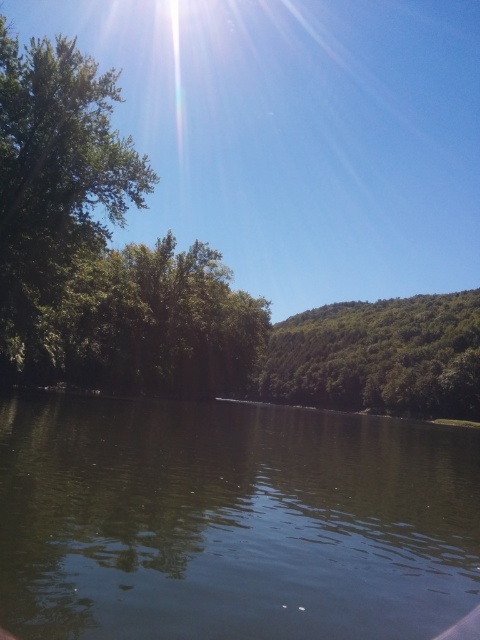
Does green reflective water at center appear on the left side of green leafy tree at left?

No, green reflective water at center is not to the left of green leafy tree at left.

In the scene shown: Who is taller, green reflective water at center or green leafy tree at left?

With more height is green leafy tree at left.

Measure the distance between point (302, 600) and camera.

A: 7.39 meters

Where is `green reflective water at center`? The image size is (480, 640). green reflective water at center is located at coordinates (231, 522).

Can you confirm if green reflective water at center is thinner than green leafy hillside at center?

Yes, green reflective water at center is thinner than green leafy hillside at center.

You are a GUI agent. You are given a task and a screenshot of the screen. Output one action in this format:
    pyautogui.click(x=<x>, y=<y>)
    Task: Click on the green reflective water at center
    
    Given the screenshot: What is the action you would take?
    pyautogui.click(x=231, y=522)

Find the location of `green reflective water at center`. green reflective water at center is located at coordinates (231, 522).

Does point (79, 104) come behind point (339, 371)?

No, (79, 104) is closer to viewer.

Image resolution: width=480 pixels, height=640 pixels. Find the location of `green leafy tree at left`. green leafy tree at left is located at coordinates (55, 186).